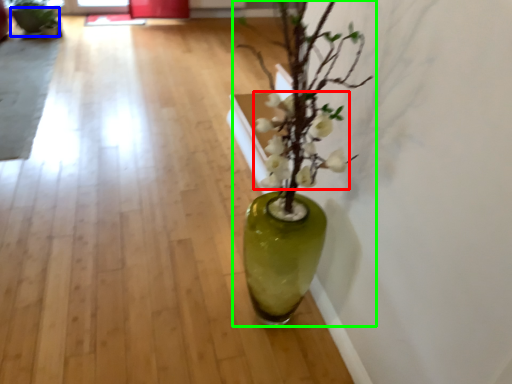
Question: Which object is positioned closest to flower (highlighted by a red box)? Select from flowerpot (highlighted by a blue box) and houseplant (highlighted by a green box).

Choices:
 (A) flowerpot
 (B) houseplant

Answer: (B)